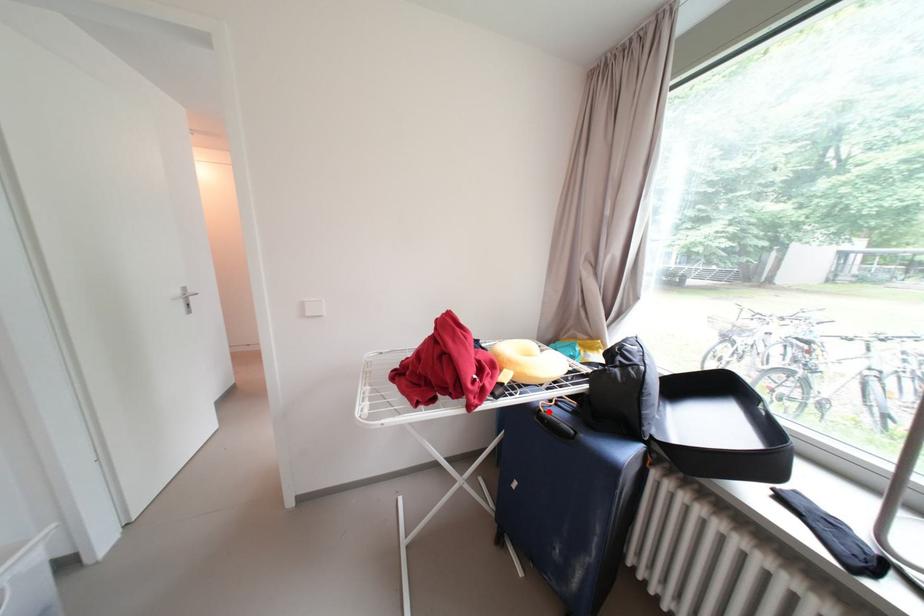
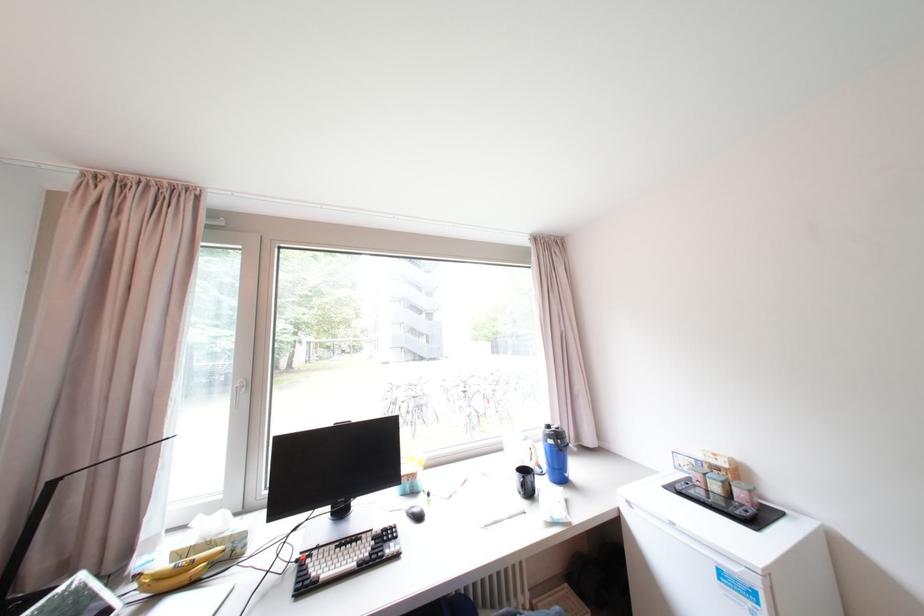
Question: I am providing you with two images of the same scene from different viewpoints. A red point is marked on the first image. Is the red point's position out of view in image 2?

Choices:
 (A) Yes
 (B) No

Answer: (A)